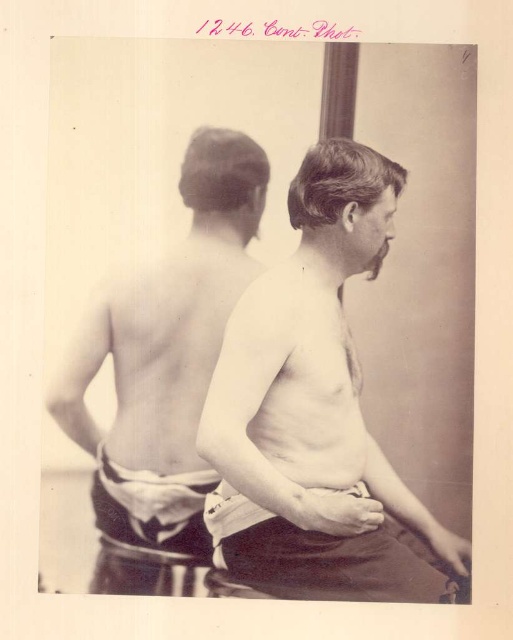
You are a photographer analyzing this historical image. You notice the smooth skin man at center and the white cotton underclothes at lower center. Which object is located to the left of the other?

The smooth skin man at center is positioned on the left side of white cotton underclothes at lower center.

You are an anthropologist analyzing this historical photograph. You notice a point at coordinates (314,413). Based on the scene, what anatomical region of the human body does this point most likely correspond to?

The point at coordinates (314,413) is on the smooth skin torso at center, which corresponds to the chest or abdominal region of the human body.

You are a photographer trying to capture a similar pose for a modern art project. The two models must stand back to back. Given that the distance between the smooth skin torso at center and the smooth skin man at center in the original photo is 5.91 inches, what is the minimum space required between the models to replicate this pose accurately?

The minimum space required between the smooth skin torso at center and the smooth skin man at center to replicate the pose accurately is 5.91 inches, as they are 5.91 inches apart from each other in the original photo.